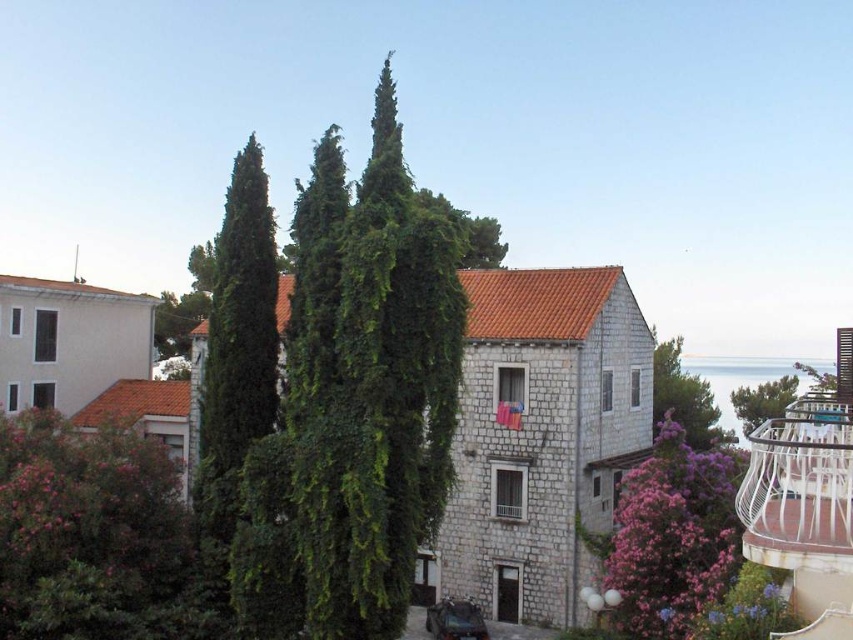
Question: Which point is closer to the camera?

Choices:
 (A) (86, 540)
 (B) (706, 413)
 (C) (421, 492)
 (D) (846, 512)

Answer: (D)

Question: From the image, what is the correct spatial relationship of white metal balcony at upper right in relation to green leafy tree at upper center?

Choices:
 (A) left
 (B) right

Answer: (A)

Question: Estimate the real-world distances between objects in this image. Which object is closer to the green leafy tree at center?

Choices:
 (A) green leafy bush at lower left
 (B) green leafy cypress at center
 (C) green leafy tree at upper center
 (D) white metal balcony at upper right

Answer: (C)

Question: Is green leafy tree at center wider than green leafy tree at upper center?

Choices:
 (A) yes
 (B) no

Answer: (B)

Question: Does white metal balcony at upper right come behind green leafy tree at upper center?

Choices:
 (A) yes
 (B) no

Answer: (B)

Question: Which object is the farthest from the green leafy tree at upper center?

Choices:
 (A) green leafy bush at lower left
 (B) white metal balcony at upper right

Answer: (A)